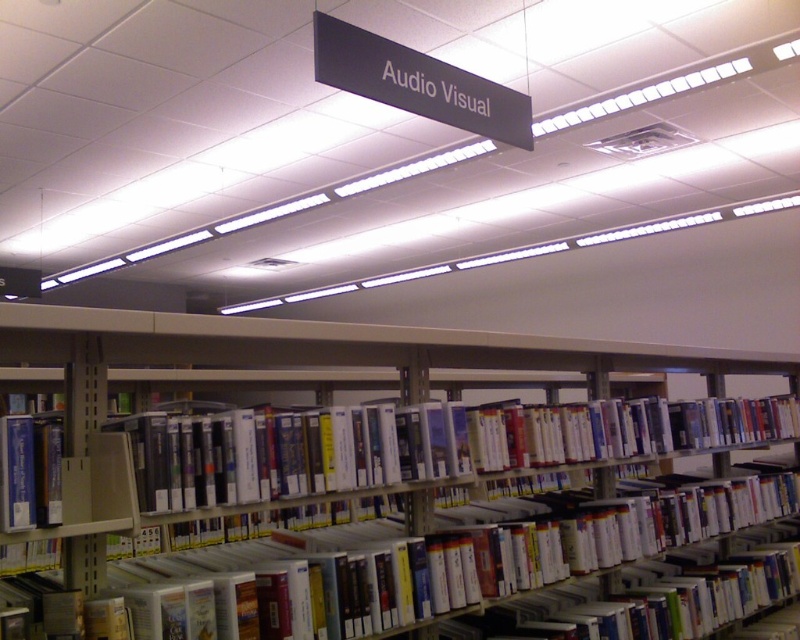
You are a librarian who needs to reach the top shelf of the metallic gray bookcase at center. Your arm can extend 1.2 meters. Can you reach the top shelf?

The metallic gray bookcase at center is 1.46 meters from camera. Since your arm can only extend 1.2 meters, you cannot reach the top shelf.

You are a librarian trying to place a new item on the shelf. You have a blue hardcover book at left and a metallic gray bookcase at center. Which one is taller?

The metallic gray bookcase at center is taller than the blue hardcover book at left.

You are a librarian who needs to place a new blue hardcover book at left onto the metallic gray bookcase at center. Can you walk directly to the bookcase without stepping around any obstacles, given that you have a 0.5 meter wide cart?

The distance between the metallic gray bookcase at center and the blue hardcover book at left is 1.41 meters. Since the cart is 0.5 meters wide, there is enough space for the cart to move directly between them without needing to go around any obstacles.